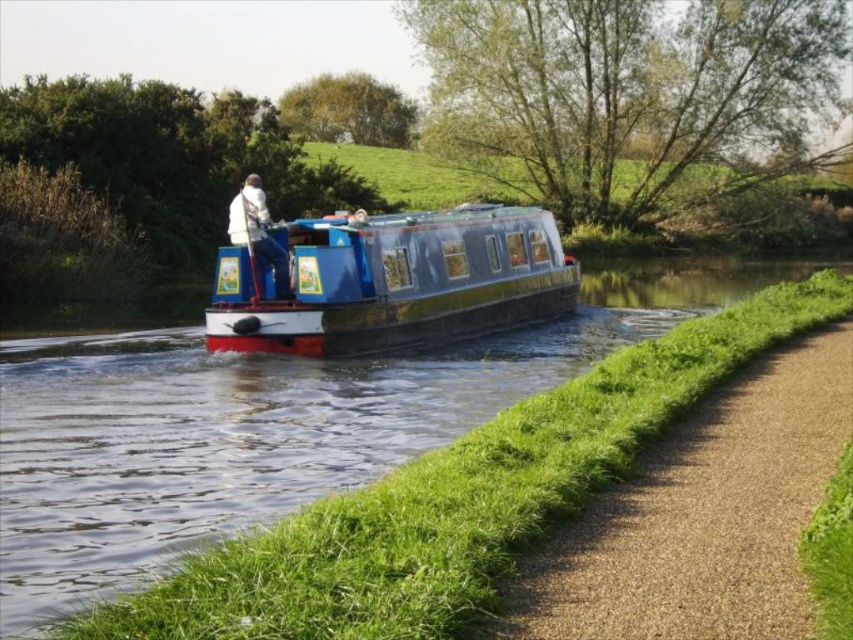
You are standing on the towpath next to the canal and want to take a photo of the blue glossy canal boat at center. If your camera can focus on objects up to 6 meters away, will you be able to capture a clear photo of the boat?

The blue glossy canal boat at center is 5.72 meters away from the camera, which is within the camera focus range of up to 6 meters. Therefore, you can capture a clear photo of the boat.

You are a passenger on the blue polished wood boat at center and want to wave to someone standing on the towpath near the white matte jacket at center. Since the boat is moving forward, which object will appear to move away first from your view?

The white matte jacket at center will appear to move away first because it is farther from the viewer compared to the blue polished wood boat at center, so as the boat moves forward, the jacket will become less visible sooner.

You are a delivery drone flying at a low altitude above the canal. You need to pass between the blue glossy canal boat at center and the gravel path at lower right. Can you safely navigate through the space between them without hitting either?

The blue glossy canal boat at center is taller than the gravel path at lower right, so the drone can safely navigate between them as long as it stays below the height of the boat and above the gravel path.